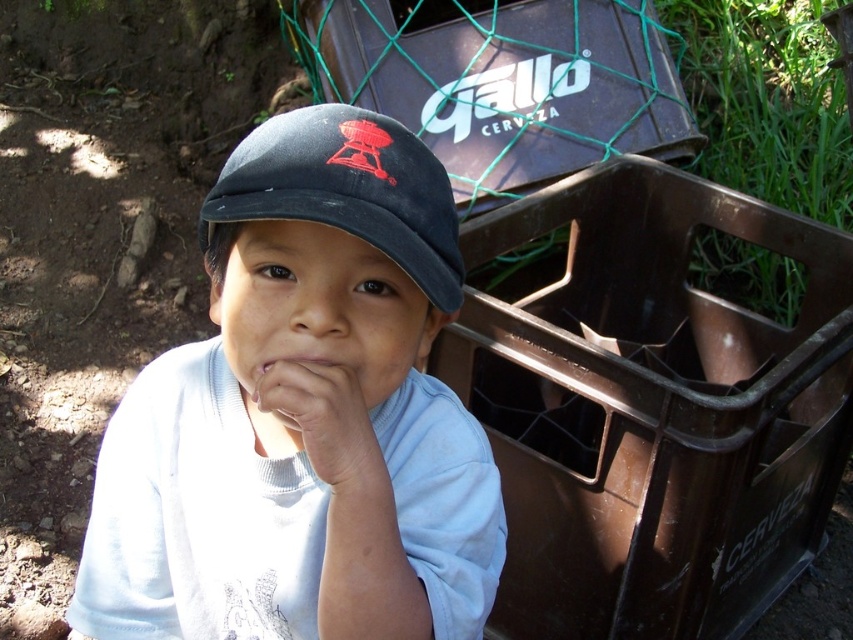
Question: Which point appears farthest from the camera in this image?

Choices:
 (A) (312, 179)
 (B) (318, 448)

Answer: (B)

Question: Which of the following is the closest to the observer?

Choices:
 (A) black fabric cap at center
 (B) white matte hand at center

Answer: (A)

Question: Does matte blue cap at center have a greater width compared to white matte hand at center?

Choices:
 (A) yes
 (B) no

Answer: (A)

Question: Does matte blue cap at center have a larger size compared to black fabric cap at center?

Choices:
 (A) no
 (B) yes

Answer: (B)

Question: Is matte blue cap at center to the left of black fabric cap at center from the viewer's perspective?

Choices:
 (A) no
 (B) yes

Answer: (B)

Question: Among these points, which one is nearest to the camera?

Choices:
 (A) (318, 465)
 (B) (431, 173)
 (C) (393, 442)

Answer: (A)